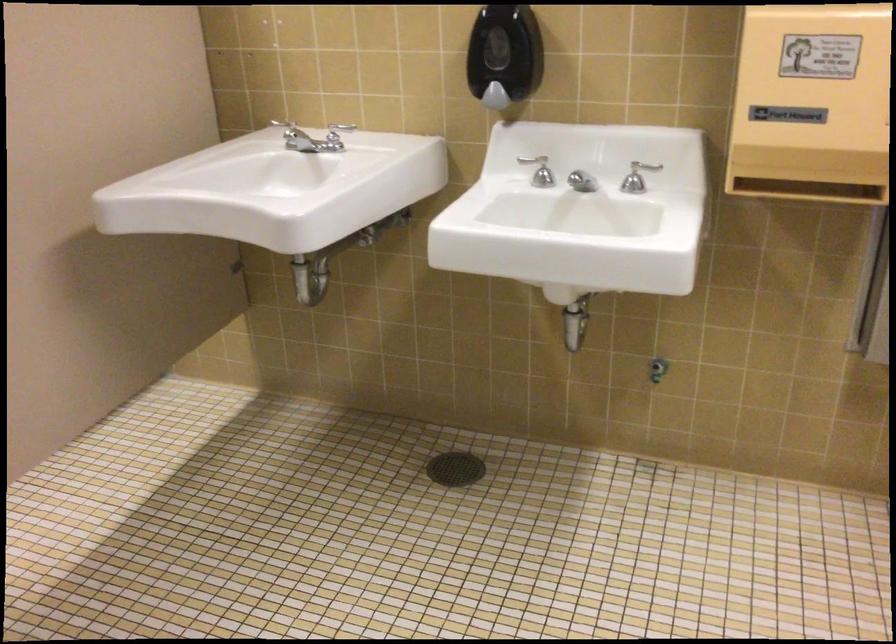
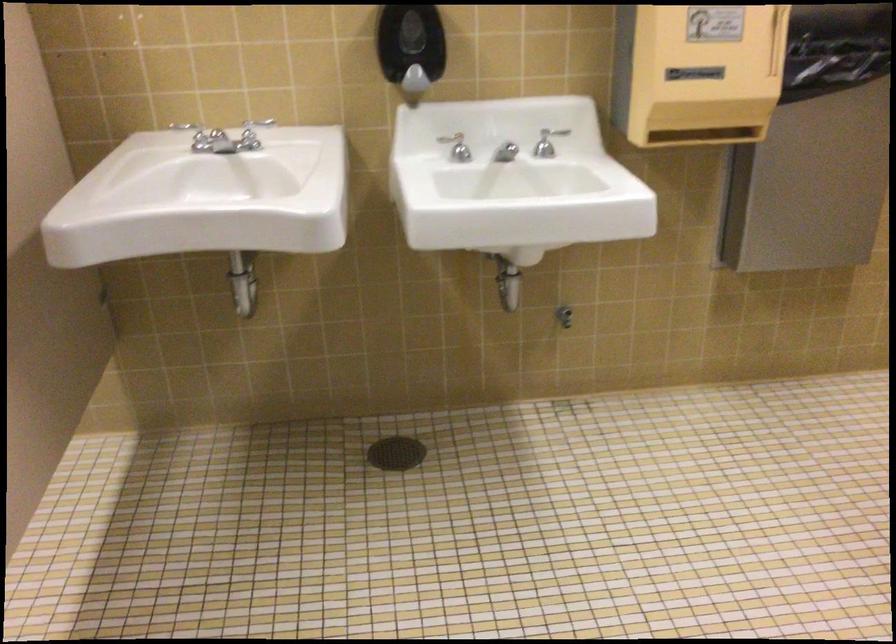
Find the pixel in the second image that matches [599,182] in the first image.

(505, 152)